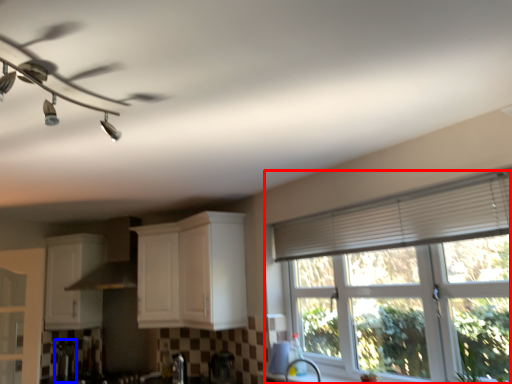
Question: Which object appears farthest to the camera in this image, window (highlighted by a red box) or appliance (highlighted by a blue box)?

Choices:
 (A) window
 (B) appliance

Answer: (B)